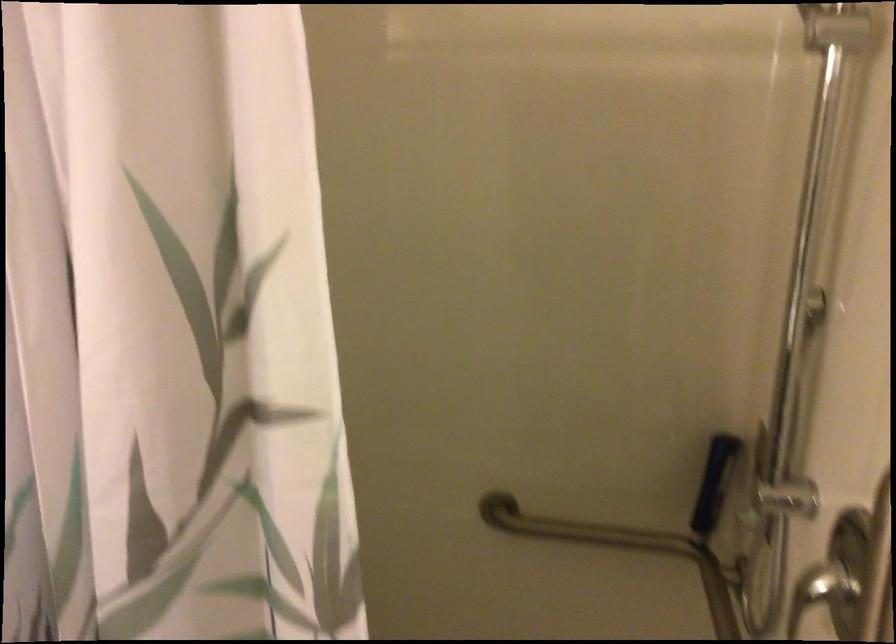
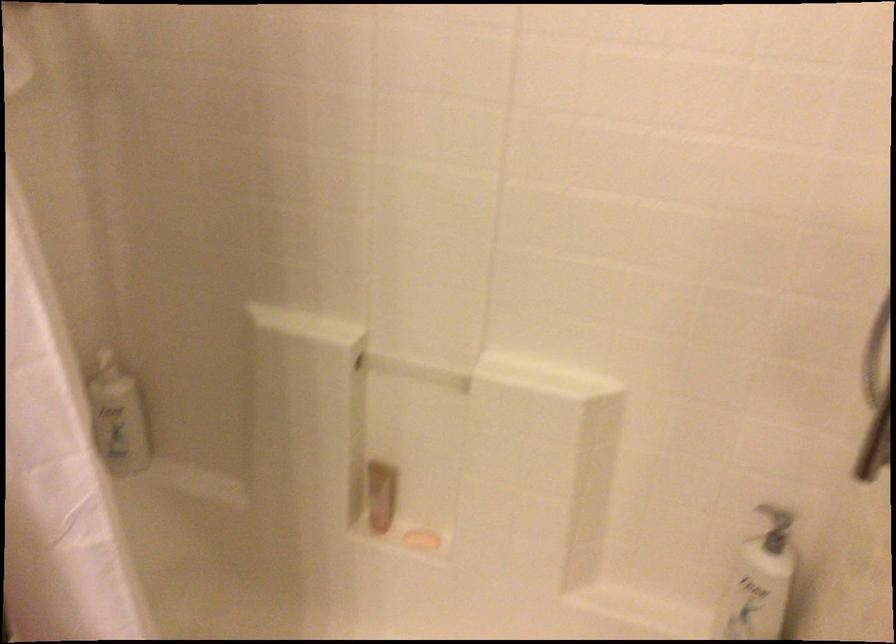
The images are taken continuously from a first-person perspective. In which direction are you moving?

The movement direction of the cameraman is left, forward.